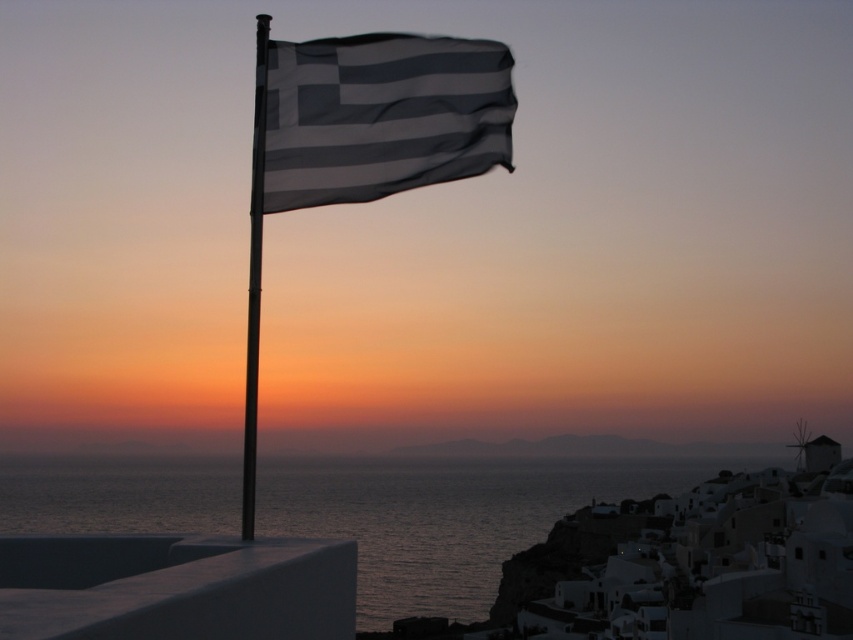
Who is shorter, transparent water at lower left or smooth concrete ledge at lower left?

With less height is smooth concrete ledge at lower left.

How much distance is there between transparent water at lower left and smooth concrete ledge at lower left?

A distance of 328.76 meters exists between transparent water at lower left and smooth concrete ledge at lower left.

Does point (114, 518) come farther from viewer compared to point (259, 538)?

Yes, it is behind point (259, 538).

What are the coordinates of `transparent water at lower left` in the screenshot? It's located at (444, 518).

Is point (315, 104) less distant than point (347, 566)?

No.

Who is more distant from viewer, (262, 132) or (252, 602)?

Positioned behind is point (262, 132).

Where is `dark gray fabric flag at center`? Image resolution: width=853 pixels, height=640 pixels. dark gray fabric flag at center is located at coordinates tap(380, 115).

Which is above, dark gray fabric flag at center or metallic flag pole at upper left?

dark gray fabric flag at center is above.

Between dark gray fabric flag at center and metallic flag pole at upper left, which one has more height?

metallic flag pole at upper left is taller.

What do you see at coordinates (380, 115) in the screenshot? I see `dark gray fabric flag at center` at bounding box center [380, 115].

This screenshot has width=853, height=640. Identify the location of dark gray fabric flag at center. (380, 115).